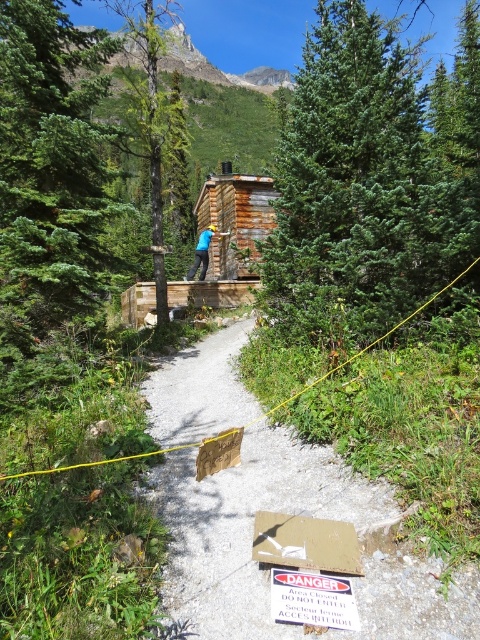
In the scene shown: Does green fir tree at center have a larger size compared to rustic wooden cabin at center?

Indeed, green fir tree at center has a larger size compared to rustic wooden cabin at center.

Is green fir tree at center wider than rustic wooden cabin at center?

Correct, the width of green fir tree at center exceeds that of rustic wooden cabin at center.

Locate an element on the screen. green fir tree at center is located at coordinates (360, 188).

The height and width of the screenshot is (640, 480). What are the coordinates of `green fir tree at center` in the screenshot? It's located at (360, 188).

Can you confirm if dark brown bark tree at center is smaller than white cardboard sign at center?

Incorrect, dark brown bark tree at center is not smaller in size than white cardboard sign at center.

How distant is dark brown bark tree at center from white cardboard sign at center?

dark brown bark tree at center and white cardboard sign at center are 16.83 meters apart.

Who is more distant from viewer, (153,198) or (277,598)?

The point (153,198) is behind.

Where is `dark brown bark tree at center`? The width and height of the screenshot is (480, 640). dark brown bark tree at center is located at coordinates (151, 129).

Is rustic wooden cabin at center taller than blue cotton shirt at center?

Yes.

Is rustic wooden cabin at center to the left of blue cotton shirt at center from the viewer's perspective?

In fact, rustic wooden cabin at center is to the right of blue cotton shirt at center.

Which is in front, point (217, 259) or point (202, 241)?

Point (202, 241)

The image size is (480, 640). What are the coordinates of `rustic wooden cabin at center` in the screenshot? It's located at (236, 220).